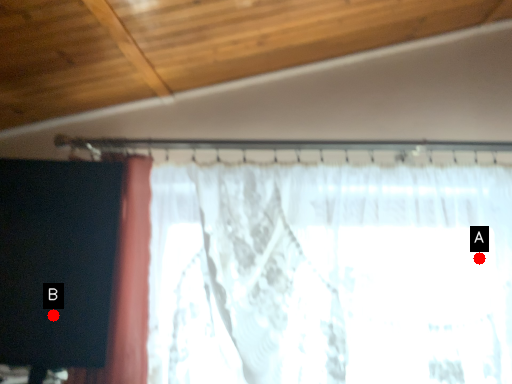
Question: Two points are circled on the image, labeled by A and B beside each circle. Which point appears closest to the camera in this image?

Choices:
 (A) A is closer
 (B) B is closer

Answer: (B)